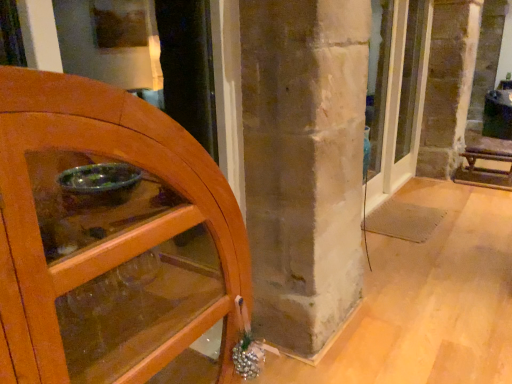
Question: From a real-world perspective, is wooden cabinet at left, the 2th door in the back-to-front sequence, on top of wooden bench at right?

Choices:
 (A) yes
 (B) no

Answer: (A)

Question: Would you say wooden bench at right is part of wooden cabinet at left, which is the first door from left to right,'s contents?

Choices:
 (A) no
 (B) yes

Answer: (A)

Question: From the image's perspective, is wooden cabinet at left, which is the first door from left to right, on top of wooden bench at right?

Choices:
 (A) yes
 (B) no

Answer: (B)

Question: Can you confirm if wooden cabinet at left, placed as the second door when sorted from right to left, is positioned to the right of wooden bench at right?

Choices:
 (A) no
 (B) yes

Answer: (A)

Question: From the image's perspective, does wooden cabinet at left, placed as the second door when sorted from right to left, appear lower than wooden bench at right?

Choices:
 (A) yes
 (B) no

Answer: (A)

Question: Is matte glass door at center, which is counted as the 1th door, starting from the right, inside or outside of wooden bench at right?

Choices:
 (A) outside
 (B) inside

Answer: (A)

Question: From the image's perspective, is matte glass door at center, the second door from the front, above or below wooden bench at right?

Choices:
 (A) below
 (B) above

Answer: (B)

Question: In terms of height, does matte glass door at center, which is counted as the 1th door, starting from the right, look taller or shorter compared to wooden bench at right?

Choices:
 (A) tall
 (B) short

Answer: (A)

Question: Relative to wooden bench at right, is matte glass door at center, the second door from the front, in front or behind?

Choices:
 (A) front
 (B) behind

Answer: (A)

Question: Would you say wooden bench at right is to the left or to the right of matte glass door at center, which is the 1th door in back-to-front order, in the picture?

Choices:
 (A) left
 (B) right

Answer: (B)

Question: Considering the positions of point (481, 185) and point (401, 16), is point (481, 185) closer or farther from the camera than point (401, 16)?

Choices:
 (A) closer
 (B) farther

Answer: (B)

Question: In terms of height, does wooden bench at right look taller or shorter compared to matte glass door at center, the second door from the front?

Choices:
 (A) tall
 (B) short

Answer: (B)

Question: In the image, is wooden bench at right positioned in front of or behind matte glass door at center, which is the 2th door from left to right?

Choices:
 (A) front
 (B) behind

Answer: (B)

Question: Does point (459, 178) appear closer or farther from the camera than point (39, 104)?

Choices:
 (A) closer
 (B) farther

Answer: (B)

Question: In terms of width, does wooden bench at right look wider or thinner when compared to wooden cabinet at left, placed as the second door when sorted from right to left?

Choices:
 (A) wide
 (B) thin

Answer: (A)